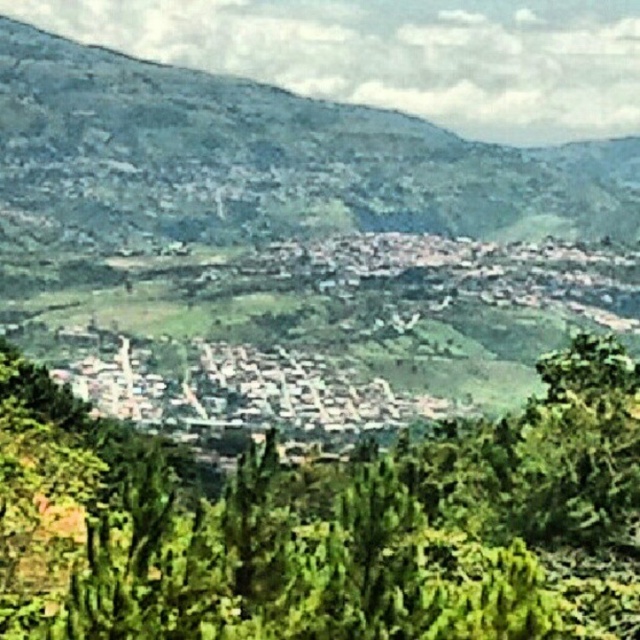
Question: Considering the real-world distances, which object is farthest from the green leafy tree at center?

Choices:
 (A) green textured hillside at upper left
 (B) white stone buildings at center

Answer: (A)

Question: Can you confirm if green leafy tree at center is positioned to the right of white stone buildings at center?

Choices:
 (A) yes
 (B) no

Answer: (A)

Question: In this image, where is green leafy tree at center located relative to green textured hillside at upper left?

Choices:
 (A) left
 (B) right

Answer: (A)

Question: Which object is the farthest from the white stone buildings at center?

Choices:
 (A) green leafy tree at center
 (B) green textured hillside at upper left

Answer: (B)

Question: Which of these objects is positioned farthest from the white stone buildings at center?

Choices:
 (A) green textured hillside at upper left
 (B) green leafy tree at center

Answer: (A)

Question: Observing the image, what is the correct spatial positioning of green leafy tree at center in reference to green textured hillside at upper left?

Choices:
 (A) left
 (B) right

Answer: (A)